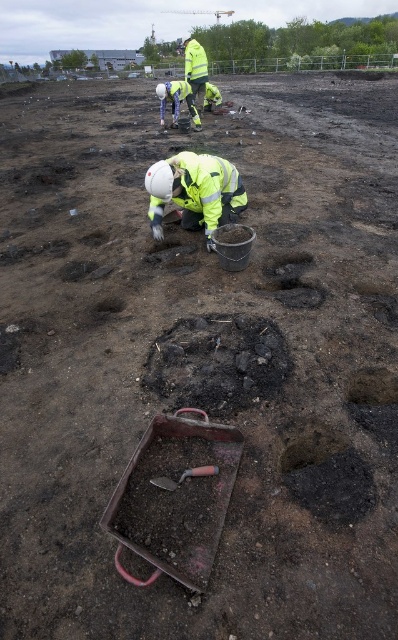
You are a drone operator tasked with capturing aerial footage of the excavation site. The drone is currently hovering above the reflective yellow safety vest at upper center. To ensure safety, you must avoid flying over any workers. The safety vest is at coordinates 0.159, 0.445. If the workers are standing in the circular holes, which are located at coordinates 0.3, 0.5 and 0.6, 0.7, can the drone safely move to the coordinates 0.2, 0.4 without flying over any workers?

The reflective yellow safety vest at upper center is at coordinates (177,100). The workers are in the circular holes at (199,192) and (278,384). The drone moving to (159,128) would not pass over any of the worker locations since it is closer to the safety vest and away from the holes. Therefore, the drone can safely move to those coordinates without flying over workers.

You are an archaeologist at the excavation site. You need to choose between the high visibility yellow jacket at center and the reflective yellow safety vest at upper center for your fieldwork. Which one would provide better visibility to your team members?

The reflective yellow safety vest at upper center is larger than the high visibility yellow jacket at center, so it would provide better visibility to your team members.